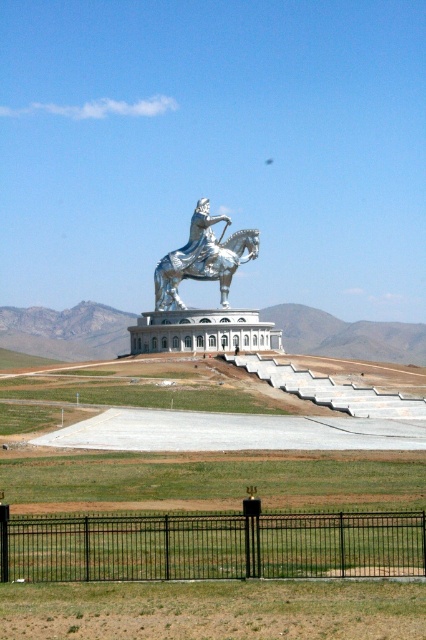
You are standing at the base of the statue and want to take a photo of the statue without any obstructions. Is there a black metal fence at lower center in your way?

The black metal fence at lower center is located at point (x=213, y=547), so it may be blocking your view of the statue. Move to a position where the fence is not in front of the statue to take an unobstructed photo.

You are standing at the bottom of the staircase leading to the platform. You want to place a small flower pot exactly at the midpoint between your current position and the shiny silver statue at center. What are the coordinates of the point where you should place the flower pot?

The midpoint between your current position at the bottom of the staircase and the shiny silver statue at center at point (201, 280) would be calculated by averaging the coordinates. Assuming your starting position is at the base of the staircase, which is likely at coordinates (0, 0), the midpoint would be at (100, 140). Therefore, place the flower pot at coordinates (100, 140).

You are standing at the base of the statue and want to walk towards the point marked at coordinates (213, 547). Which object will you encounter first?

The point at coordinates (213, 547) corresponds to the black metal fence at lower center, so you will encounter the black metal fence at lower center first.